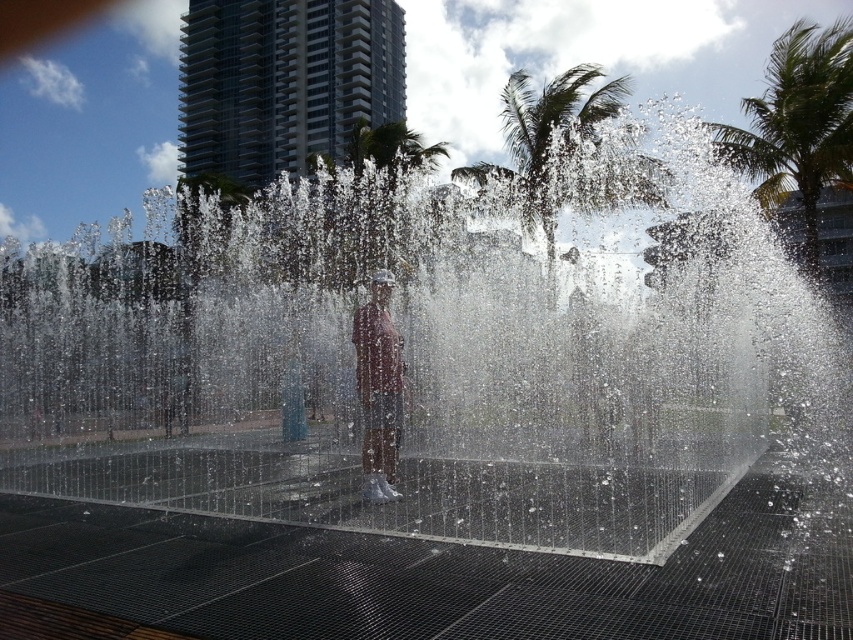
Question: Among these points, which one is nearest to the camera?

Choices:
 (A) (833, 109)
 (B) (606, 100)
 (C) (364, 400)

Answer: (C)

Question: In this image, where is green leafy palm tree at upper right located relative to green leafy palm tree at upper center?

Choices:
 (A) below
 (B) above

Answer: (B)

Question: Among these objects, which one is nearest to the camera?

Choices:
 (A) green leafy palm tree at upper center
 (B) green leafy palm tree at upper right
 (C) matte pink shirt at center

Answer: (C)

Question: Does green leafy palm tree at upper center have a lesser width compared to matte pink shirt at center?

Choices:
 (A) yes
 (B) no

Answer: (B)

Question: Which of the following is the farthest from the observer?

Choices:
 (A) green leafy palm tree at upper center
 (B) green leafy palm tree at upper right
 (C) matte pink shirt at center

Answer: (B)

Question: Can you confirm if green leafy palm tree at upper right is positioned to the right of matte pink shirt at center?

Choices:
 (A) yes
 (B) no

Answer: (A)